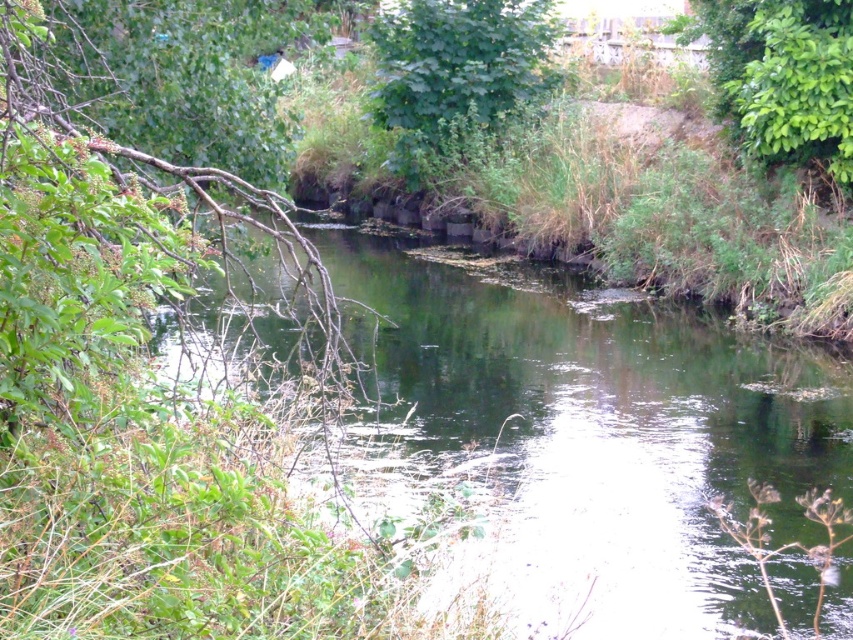
You are a hiker who wants to cross the green grassy stream at center. There is a green leafy tree at upper left nearby. Which object takes up more space in the image?

The green leafy tree at upper left occupies more space in the image than the green grassy stream at center.

You are standing in the serene natural scene depicted. There are two points marked in the image, point 1 at coordinates point (407, 74) and point 2 at coordinates point (749, 67). Which point is closer to you?

Point (407, 74) is further to the camera than point (749, 67), so point (749, 67) is closer to you.